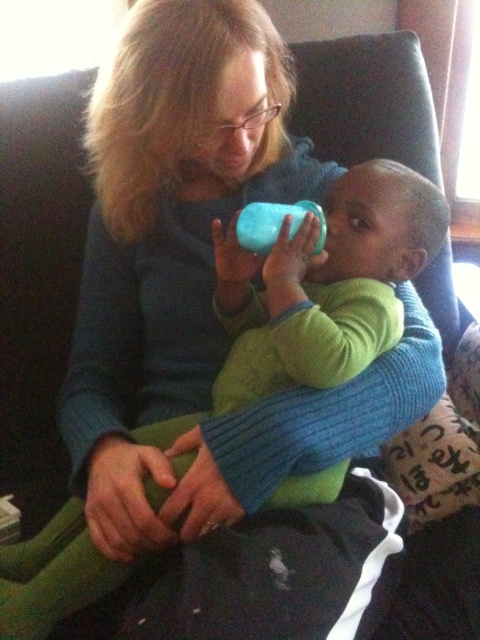
You are designing a toy storage box that needs to accommodate both the green soft baby at center and the blue rubber sippy cup at center. If the box must be just large enough to fit the wider of the two items, which item determines the minimum width requirement for the box?

The green soft baby at center is wider than the blue rubber sippy cup at center, so the box must be at least as wide as the green soft baby at center to accommodate both items.

Where is the green soft baby at center located in the image?

The green soft baby at center is located at point coordinates of (324,285).

You are a photographer trying to capture a candid shot of the green soft baby at center and the blue rubber sippy cup at center. From the perspective of someone standing in front of the couch, which object is positioned to the right side?

The blue rubber sippy cup at center is positioned to the right of the green soft baby at center.